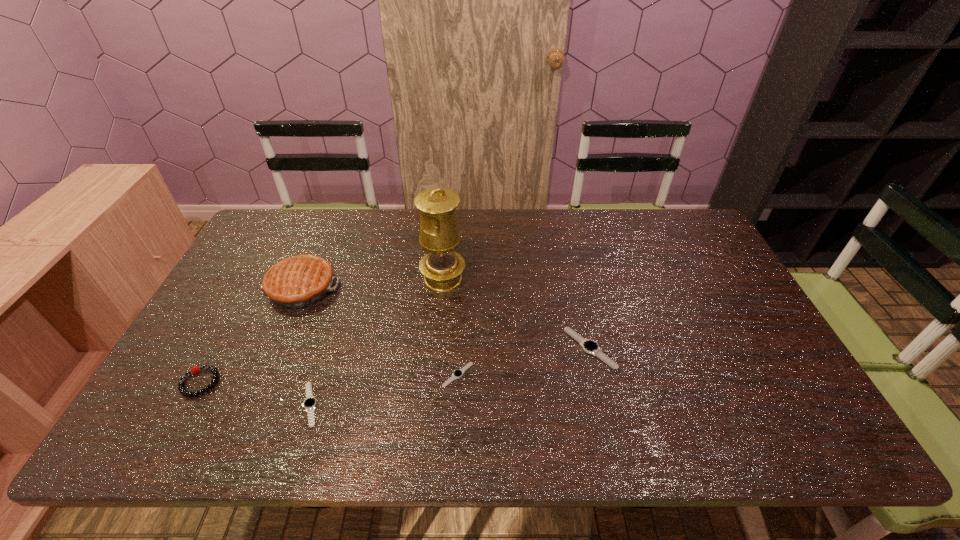
The height and width of the screenshot is (540, 960). What are the coordinates of `free region at the near edge of the desktop` in the screenshot? It's located at point(347,386).

Find the location of a particular element. free spot at the left edge of the desktop is located at coordinates (266, 306).

Where is `free point at the right edge`? The height and width of the screenshot is (540, 960). free point at the right edge is located at coordinates pyautogui.click(x=689, y=285).

Image resolution: width=960 pixels, height=540 pixels. Identify the location of vacant space at the far left corner. (293, 212).

Locate an element on the screen. This screenshot has height=540, width=960. free space at the far right corner of the desktop is located at coordinates tap(706, 243).

Locate an element on the screen. vacant space that's between the shortest object and the fourth shortest object is located at coordinates (328, 379).

Locate an element on the screen. free spot between the fourth shortest object and the second tallest object is located at coordinates (251, 335).

Find the location of a particular element. free area in between the pie and the third tallest object is located at coordinates tap(251, 335).

The image size is (960, 540). Find the location of `vacant space that's between the third shortest object and the oil lamp`. vacant space that's between the third shortest object and the oil lamp is located at coordinates (516, 314).

This screenshot has height=540, width=960. What are the coordinates of `free space between the fourth shortest object and the fifth shortest object` in the screenshot? It's located at [x=251, y=335].